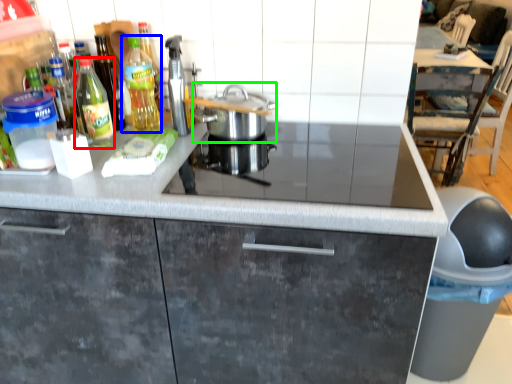
Question: Considering the real-world distances, which object is closest to kitchen appliance (highlighted by a red box)? kitchen appliance (highlighted by a blue box) or kitchen appliance (highlighted by a green box).

Choices:
 (A) kitchen appliance
 (B) kitchen appliance

Answer: (A)